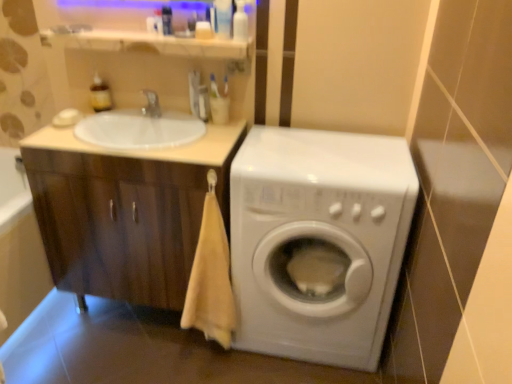
Question: Can you see translucent plastic bottle at upper center, marked as the fifth toiletry in a left-to-right arrangement, touching transparent plastic bottle at upper center, acting as the 6th toiletry starting from the left?

Choices:
 (A) yes
 (B) no

Answer: (A)

Question: Considering the relative sizes of translucent plastic bottle at upper center, marked as the fifth toiletry in a left-to-right arrangement, and transparent plastic bottle at upper center, acting as the 6th toiletry starting from the left, in the image provided, is translucent plastic bottle at upper center, marked as the fifth toiletry in a left-to-right arrangement, shorter than transparent plastic bottle at upper center, acting as the 6th toiletry starting from the left,?

Choices:
 (A) yes
 (B) no

Answer: (B)

Question: Can you confirm if translucent plastic bottle at upper center, the second toiletry positioned from the right, is taller than transparent plastic bottle at upper center, which is the first toiletry from right to left?

Choices:
 (A) yes
 (B) no

Answer: (A)

Question: Does translucent plastic bottle at upper center, marked as the fifth toiletry in a left-to-right arrangement, have a smaller size compared to transparent plastic bottle at upper center, which is the first toiletry from right to left?

Choices:
 (A) yes
 (B) no

Answer: (B)

Question: Considering the relative positions of translucent plastic bottle at upper center, the second toiletry positioned from the right, and transparent plastic bottle at upper center, acting as the 6th toiletry starting from the left, in the image provided, is translucent plastic bottle at upper center, the second toiletry positioned from the right, to the left of transparent plastic bottle at upper center, acting as the 6th toiletry starting from the left, from the viewer's perspective?

Choices:
 (A) yes
 (B) no

Answer: (A)

Question: Considering the positions of point click(201, 114) and point click(228, 6), is point click(201, 114) closer or farther from the camera than point click(228, 6)?

Choices:
 (A) farther
 (B) closer

Answer: (A)

Question: Is translucent plastic toothbrush at upper center, which is counted as the fourth toiletry, starting from the right, taller or shorter than translucent plastic bottle at upper center, the second toiletry positioned from the right?

Choices:
 (A) tall
 (B) short

Answer: (B)

Question: From a real-world perspective, relative to translucent plastic bottle at upper center, marked as the fifth toiletry in a left-to-right arrangement, is translucent plastic toothbrush at upper center, which appears as the third toiletry when viewed from the left, vertically above or below?

Choices:
 (A) above
 (B) below

Answer: (B)

Question: Considering their positions, is translucent plastic toothbrush at upper center, which appears as the third toiletry when viewed from the left, located in front of or behind translucent plastic bottle at upper center, marked as the fifth toiletry in a left-to-right arrangement?

Choices:
 (A) behind
 (B) front

Answer: (A)

Question: Is white glossy sink at upper left bigger or smaller than white glossy tap at upper center?

Choices:
 (A) big
 (B) small

Answer: (A)

Question: Is white glossy sink at upper left inside the boundaries of white glossy tap at upper center, or outside?

Choices:
 (A) outside
 (B) inside

Answer: (A)

Question: From the image's perspective, is white glossy sink at upper left above or below white glossy tap at upper center?

Choices:
 (A) above
 (B) below

Answer: (B)

Question: From a real-world perspective, is white glossy sink at upper left positioned above or below white glossy tap at upper center?

Choices:
 (A) below
 (B) above

Answer: (A)

Question: Is translucent plastic bottle at upper center, the second toiletry positioned from the right, taller or shorter than translucent amber bottle at upper left, arranged as the sixth toiletry when viewed from the right?

Choices:
 (A) tall
 (B) short

Answer: (A)

Question: Visually, is translucent plastic bottle at upper center, marked as the fifth toiletry in a left-to-right arrangement, positioned to the left or to the right of translucent amber bottle at upper left, which is the first toiletry from left to right?

Choices:
 (A) left
 (B) right

Answer: (B)